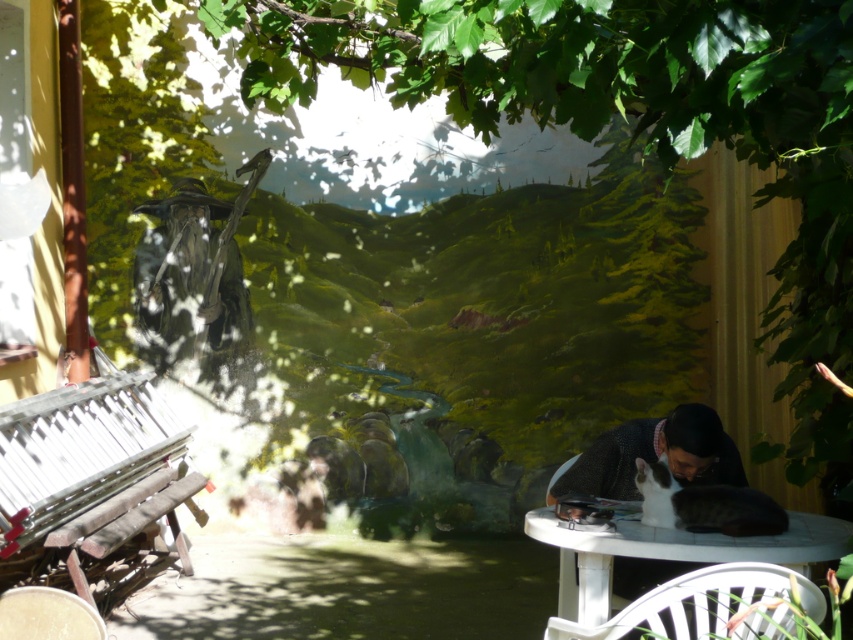
Question: From the image, what is the correct spatial relationship of white plastic table at lower right in relation to white plastic chair at lower right?

Choices:
 (A) right
 (B) left

Answer: (A)

Question: Which of the following is the closest to the observer?

Choices:
 (A) (791, 620)
 (B) (802, 529)

Answer: (A)

Question: Does white plastic table at lower right have a lesser width compared to white plastic chair at lower right?

Choices:
 (A) no
 (B) yes

Answer: (A)

Question: Can you confirm if white plastic table at lower right is smaller than white plastic chair at lower right?

Choices:
 (A) yes
 (B) no

Answer: (B)

Question: Among these objects, which one is nearest to the camera?

Choices:
 (A) white plastic table at lower right
 (B) white plastic chair at lower right

Answer: (B)